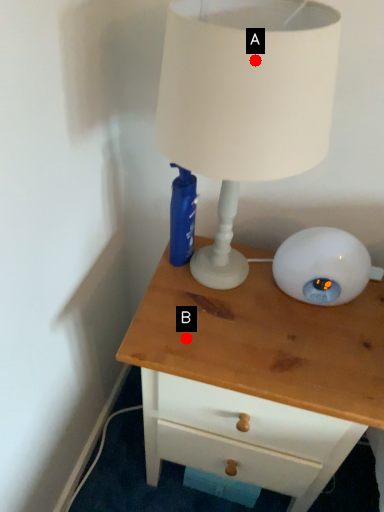
Question: Two points are circled on the image, labeled by A and B beside each circle. Which point is further to the camera?

Choices:
 (A) A is further
 (B) B is further

Answer: (B)